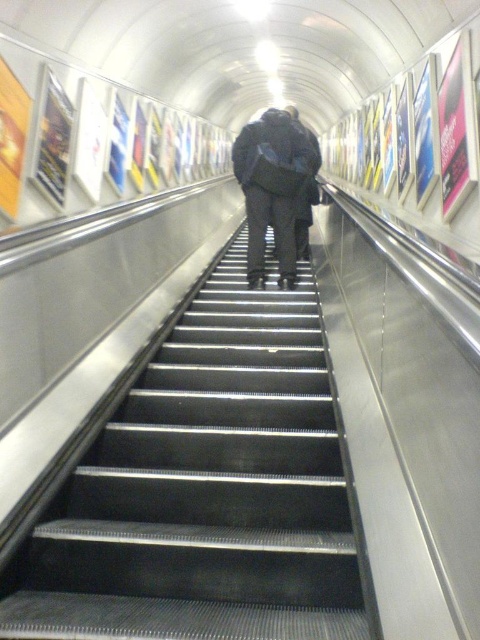
Can you confirm if metallic gray stairs at center is wider than dark gray fabric backpack at center?

Yes.

How far apart are metallic gray stairs at center and dark gray fabric backpack at center?

metallic gray stairs at center is 9.26 feet from dark gray fabric backpack at center.

Does point (149, 563) lie behind point (283, 176)?

No, it is in front of (283, 176).

Where is `metallic gray stairs at center`? This screenshot has width=480, height=640. metallic gray stairs at center is located at coordinates (204, 490).